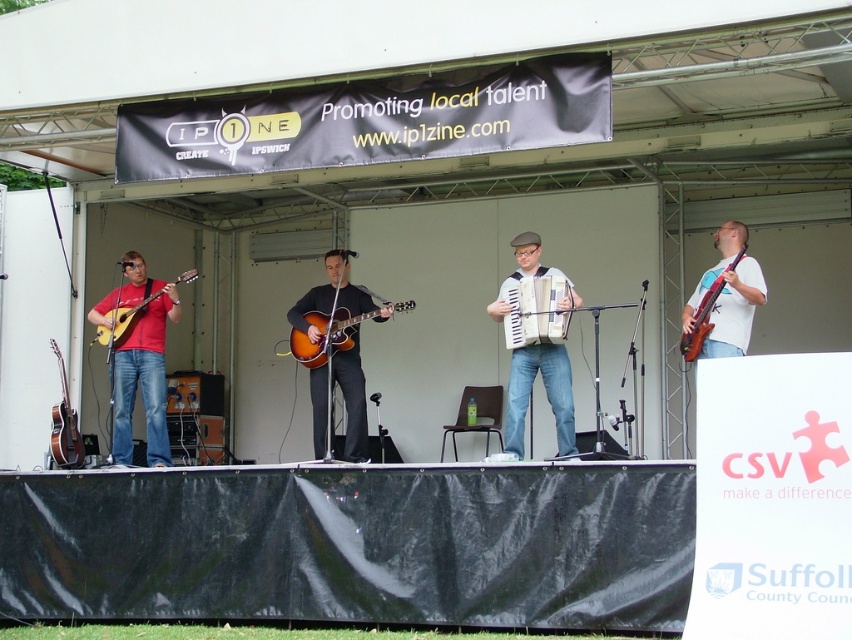
Question: Which object appears farthest from the camera in this image?

Choices:
 (A) matte brown guitar at left
 (B) brown wooden electric guitar at right
 (C) matte acoustic guitar at left

Answer: (A)

Question: Which object is positioned closest to the matte black accordion at center?

Choices:
 (A) matte brown guitar at center
 (B) brown wooden electric guitar at right
 (C) matte red shirt at left

Answer: (B)

Question: Can you confirm if matte red shirt at left is smaller than matte brown guitar at left?

Choices:
 (A) no
 (B) yes

Answer: (A)

Question: In this image, where is matte brown guitar at center located relative to matte brown guitar at left?

Choices:
 (A) below
 (B) above

Answer: (B)

Question: Considering the real-world distances, which object is farthest from the matte brown accordion at center?

Choices:
 (A) matte red shirt at left
 (B) brown wooden electric guitar at right
 (C) matte black guitar at center
 (D) matte black accordion at center

Answer: (A)

Question: Is matte red shirt at left further to camera compared to matte acoustic guitar at left?

Choices:
 (A) yes
 (B) no

Answer: (A)